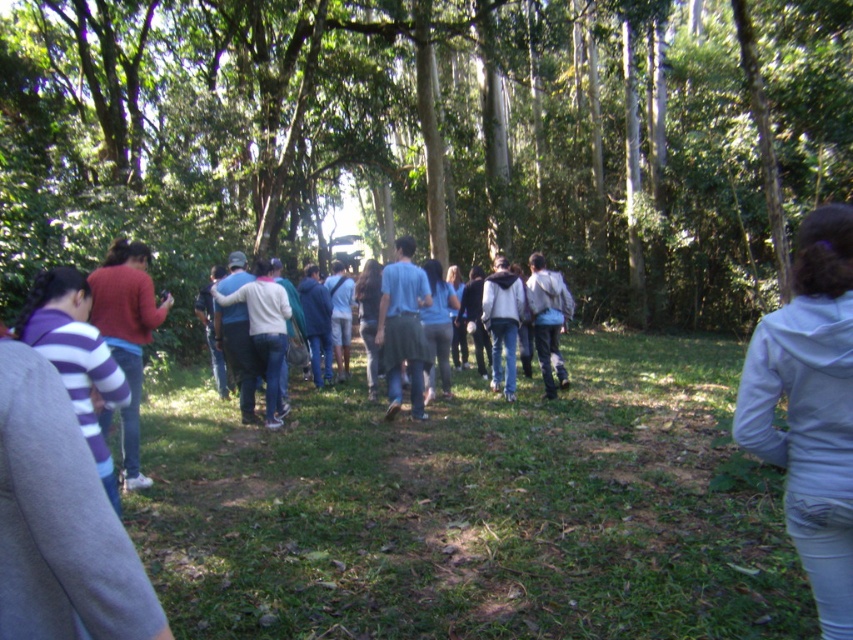
Question: Which object appears closest to the camera in this image?

Choices:
 (A) light blue denim jeans at center
 (B) green grass at center

Answer: (B)

Question: Can you confirm if blue cotton shirt at center is positioned above light blue denim shorts at center?

Choices:
 (A) yes
 (B) no

Answer: (B)

Question: Observing the image, what is the correct spatial positioning of green leafy tree at center in reference to white sweater at center?

Choices:
 (A) below
 (B) above

Answer: (B)

Question: Which point is closer to the camera?

Choices:
 (A) white sweater at center
 (B) matte red sweater at left
 (C) blue cotton shirt at center
 (D) light gray hoodie at lower right

Answer: (D)

Question: Can you confirm if light gray hoodie at lower right is smaller than light blue denim shorts at center?

Choices:
 (A) no
 (B) yes

Answer: (A)

Question: Which of the following is the farthest from the observer?

Choices:
 (A) (187, 588)
 (B) (407, 314)

Answer: (B)